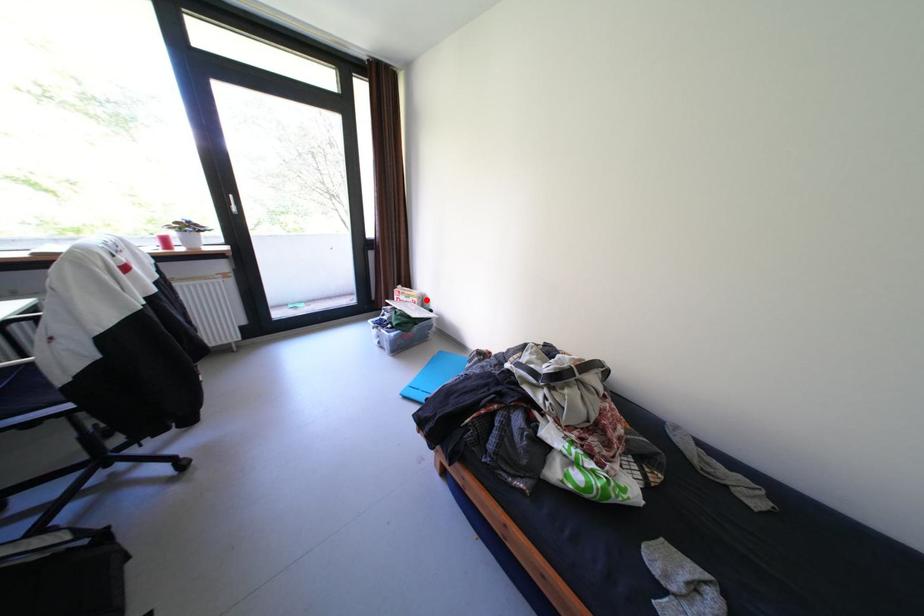
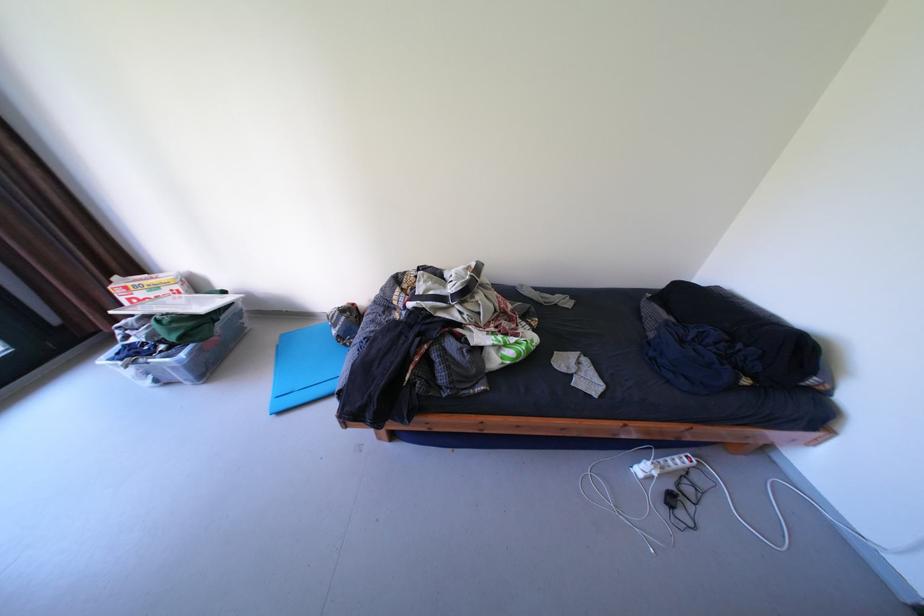
In the second image, find the point that corresponds to the highlighted location in the first image.

(188, 286)